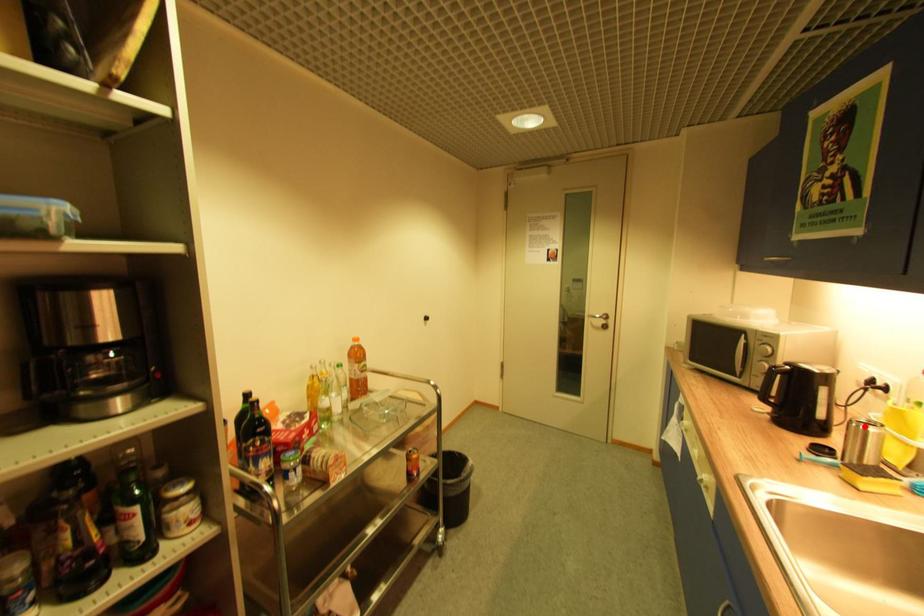
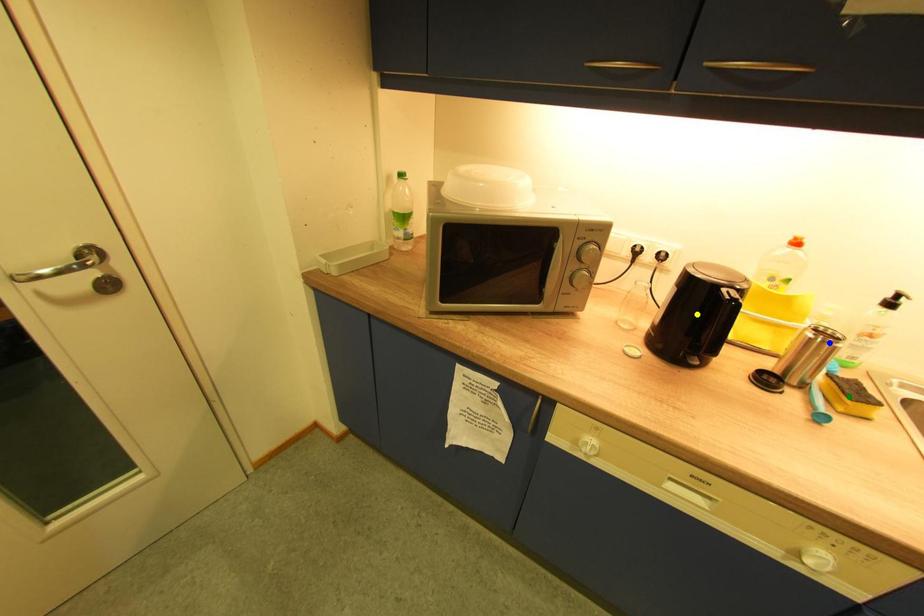
Question: I am providing you with two images of the same scene from different viewpoints. A red point is marked on the first image. You are given multiple points on the second image. Which spot in image 2 lines up with the point in image 1?

Choices:
 (A) yellow point
 (B) blue point
 (C) green point

Answer: (B)